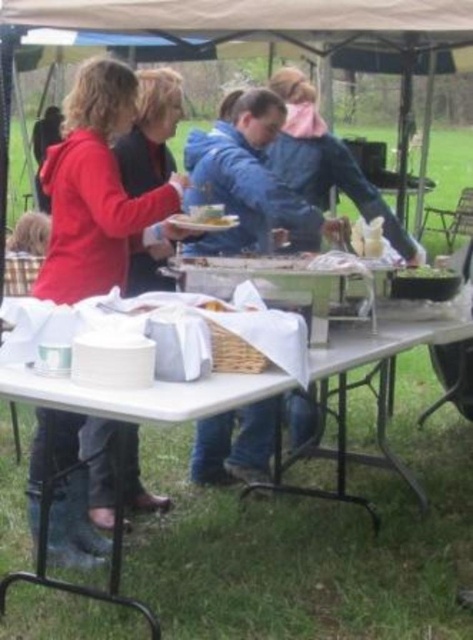
You are at the picnic and want to grab your blue denim jacket at center. Where is it located in relation to the green leafy salad at center?

The blue denim jacket at center is to the left of the green leafy salad at center.